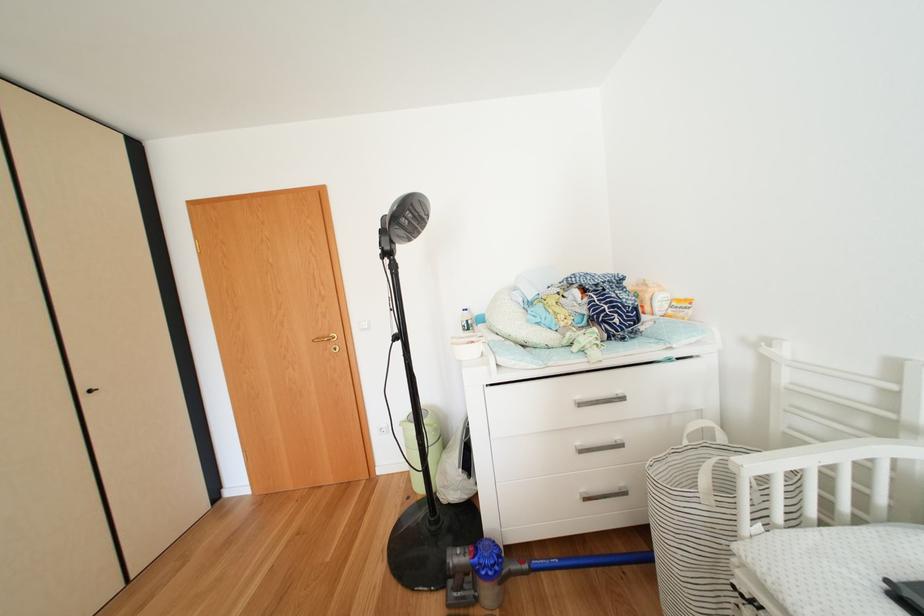
Image resolution: width=924 pixels, height=616 pixels. What are the coordinates of `gold door handle` in the screenshot? It's located at (325, 339).